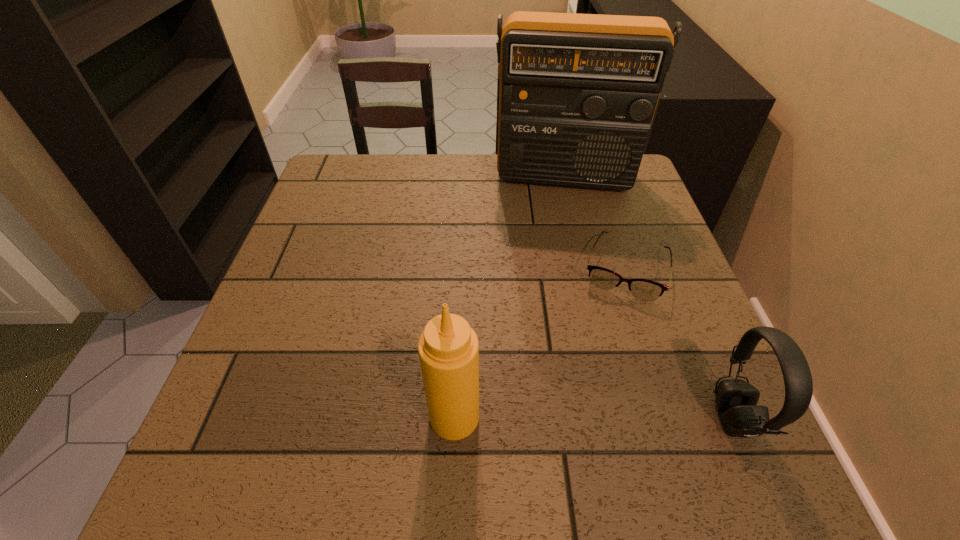
The image size is (960, 540). Find the location of `the second closest object relative to the headset`. the second closest object relative to the headset is located at coordinates (448, 348).

Identify the location of free point that satisfies the following two spatial constraints: 1. on the front side of the headset; 2. on the front-facing side of the condiment. The image size is (960, 540). (454, 417).

Where is `blank area in the image that satisfies the following two spatial constraints: 1. on the front side of the farthest object; 2. on the front-facing side of the third tallest object`? blank area in the image that satisfies the following two spatial constraints: 1. on the front side of the farthest object; 2. on the front-facing side of the third tallest object is located at coordinates (619, 417).

Find the location of a particular element. This screenshot has width=960, height=540. vacant space that satisfies the following two spatial constraints: 1. on the front side of the tallest object; 2. on the front-facing side of the headset is located at coordinates (619, 417).

The image size is (960, 540). Find the location of `free location that satisfies the following two spatial constraints: 1. on the front side of the third tallest object; 2. on the front-facing side of the spectacles`. free location that satisfies the following two spatial constraints: 1. on the front side of the third tallest object; 2. on the front-facing side of the spectacles is located at coordinates (673, 417).